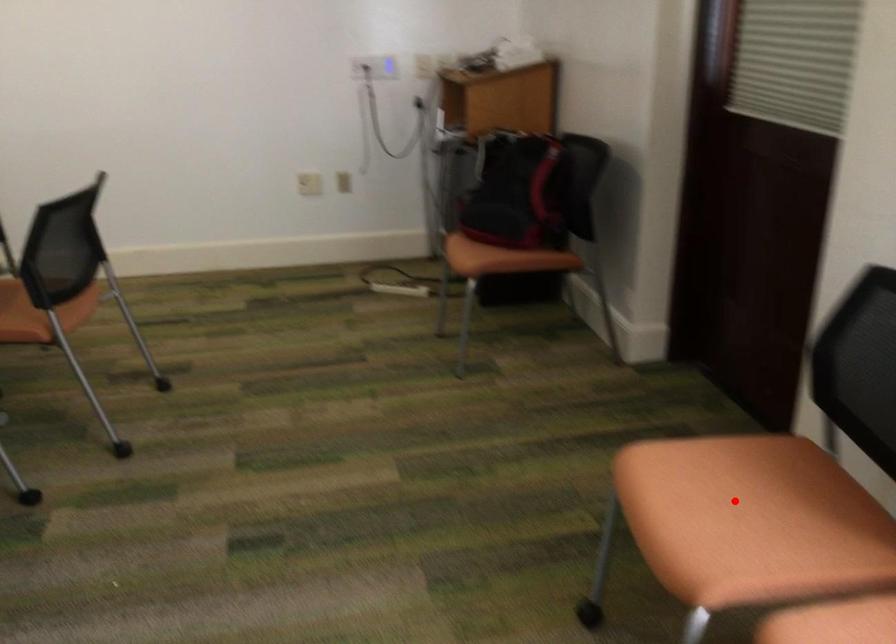
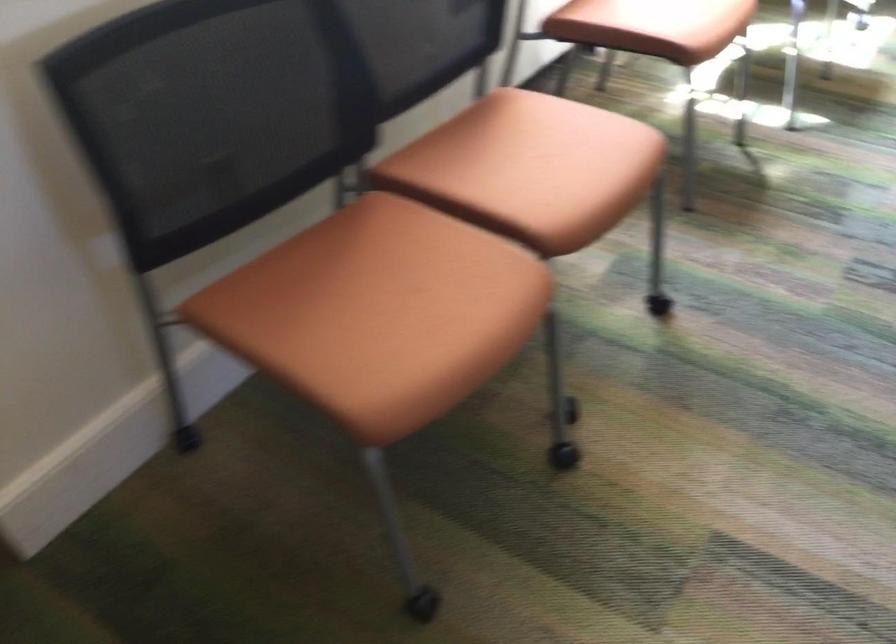
Find the pixel in the second image that matches the highlighted location in the first image.

(359, 315)